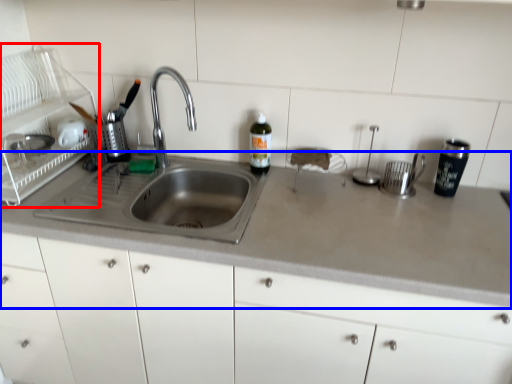
Question: Among these objects, which one is nearest to the camera, appliance (highlighted by a red box) or countertop (highlighted by a blue box)?

Choices:
 (A) appliance
 (B) countertop

Answer: (B)